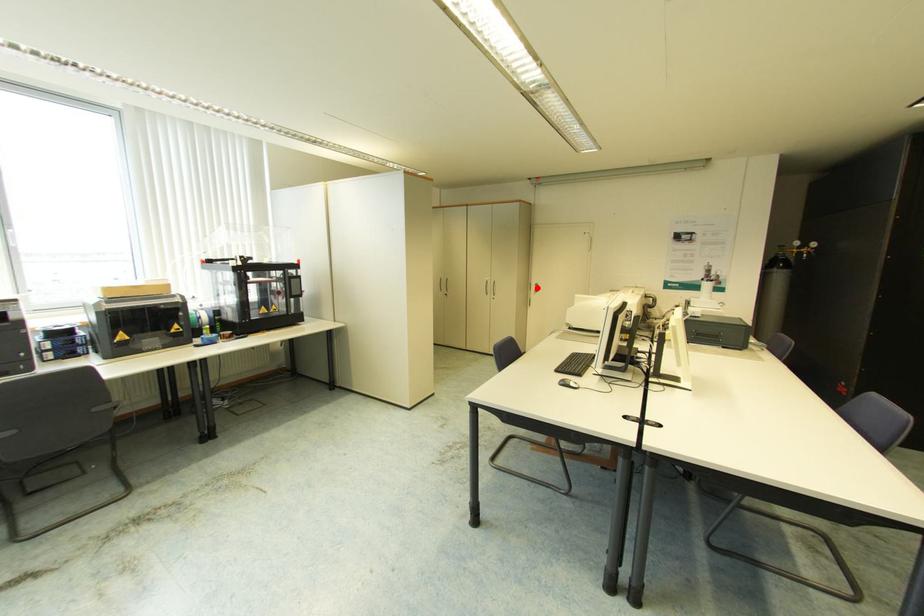
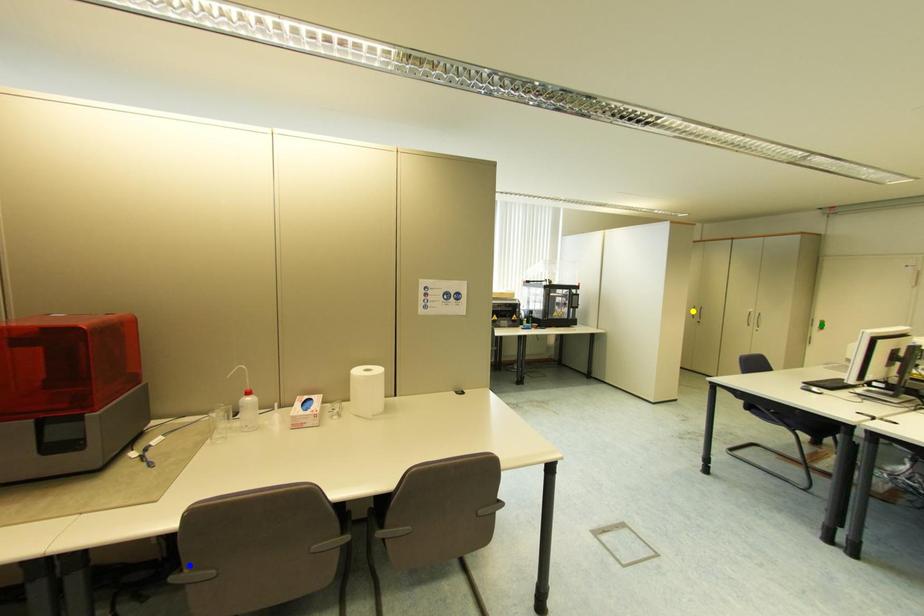
Question: I am providing you with two images of the same scene from different viewpoints. A red point is marked on the first image. You are given multiple points on the second image. Which mark in image 2 goes with the point in image 1?

Choices:
 (A) yellow point
 (B) green point
 (C) blue point

Answer: (B)